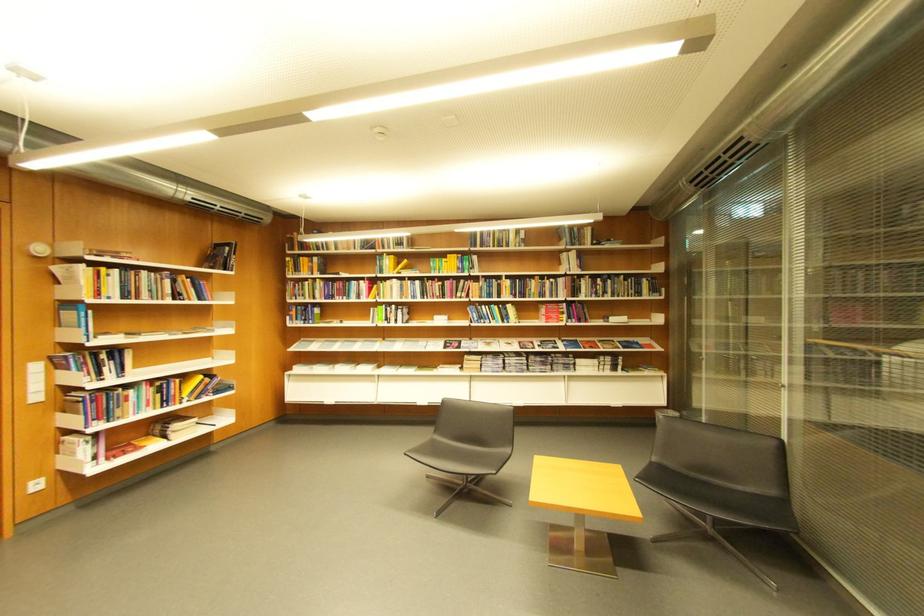
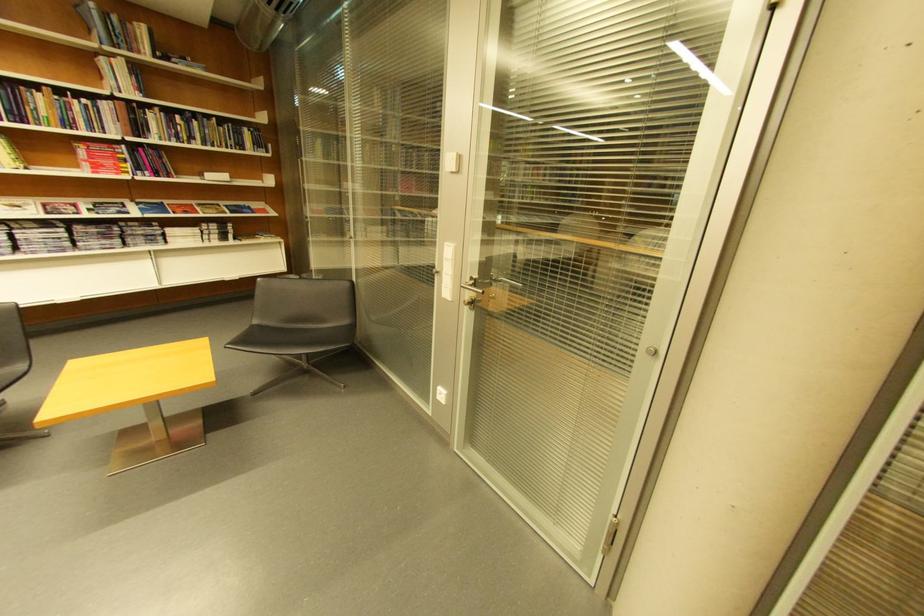
In the second image, find the point that corresponds to (x=619, y=284) in the first image.

(205, 124)